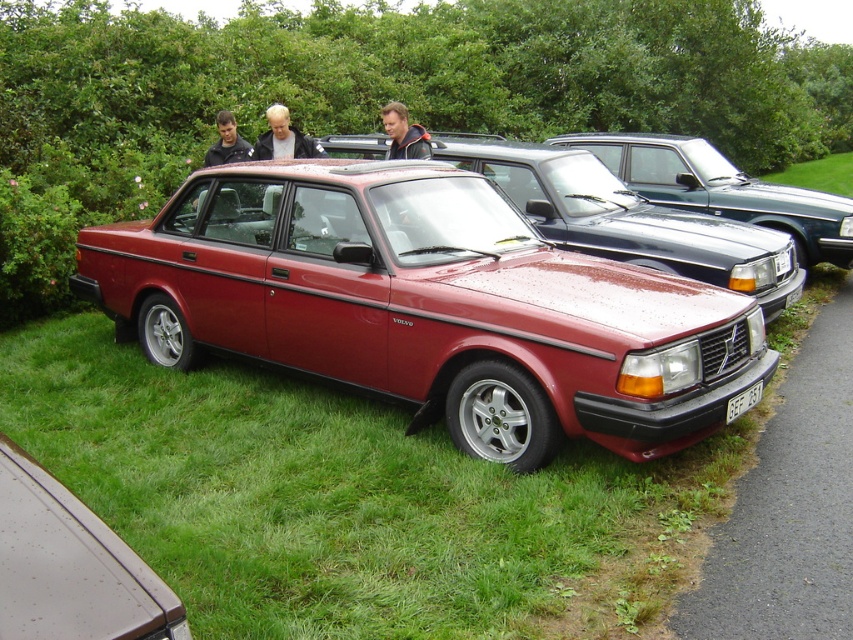
You are a photographer setting up a shot of the satin red car at center and the green grass at lower right. Which object is closer to the camera?

The satin red car at center is closer to the camera because it is in front of the green grass at lower right.

You are a photographer at a car meet and want to capture both the satin red car at center and the metallic red sedan at center in a single shot. Based on their positions, which car should you focus on first to ensure both are in frame?

The satin red car at center is below the metallic red sedan at center, so you should focus on the metallic red sedan at center first to ensure both are in frame.